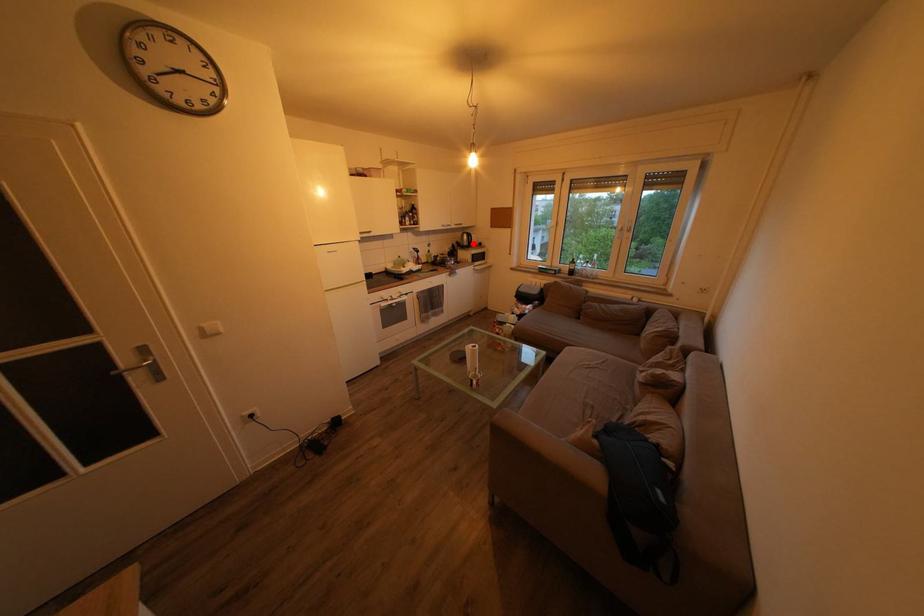
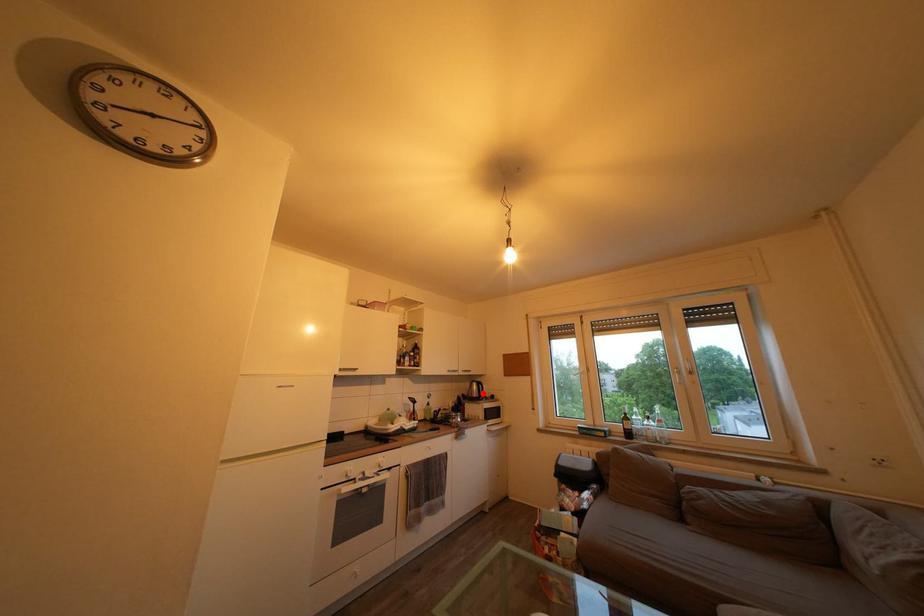
I am providing you with two images of the same scene from different viewpoints. A red point is marked on the first image and another point is marked on the second image. Are the points marked in image1 and image2 representing the same 3D position?

Yes